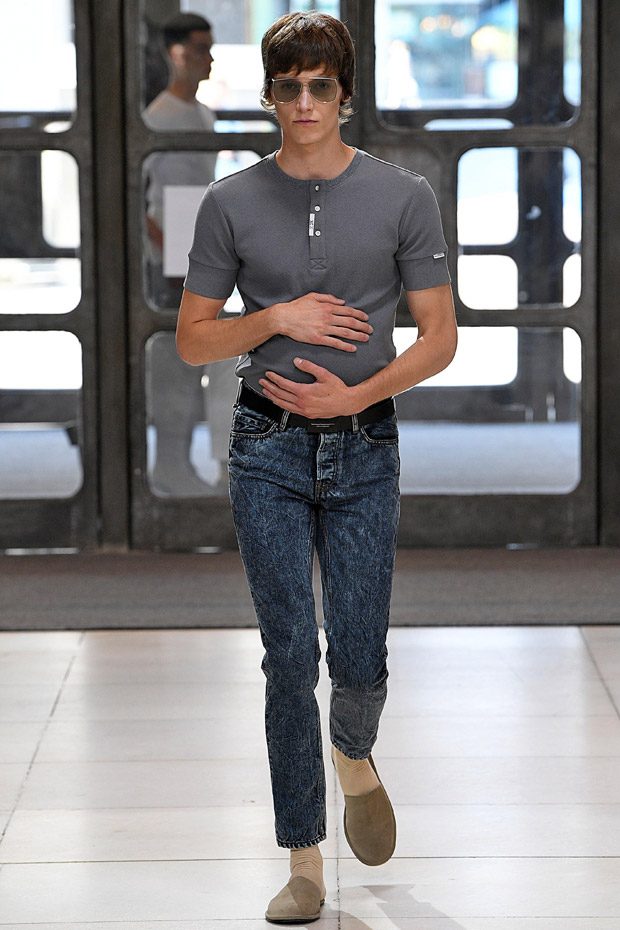
Identify the location of sock. (353, 776), (307, 862).